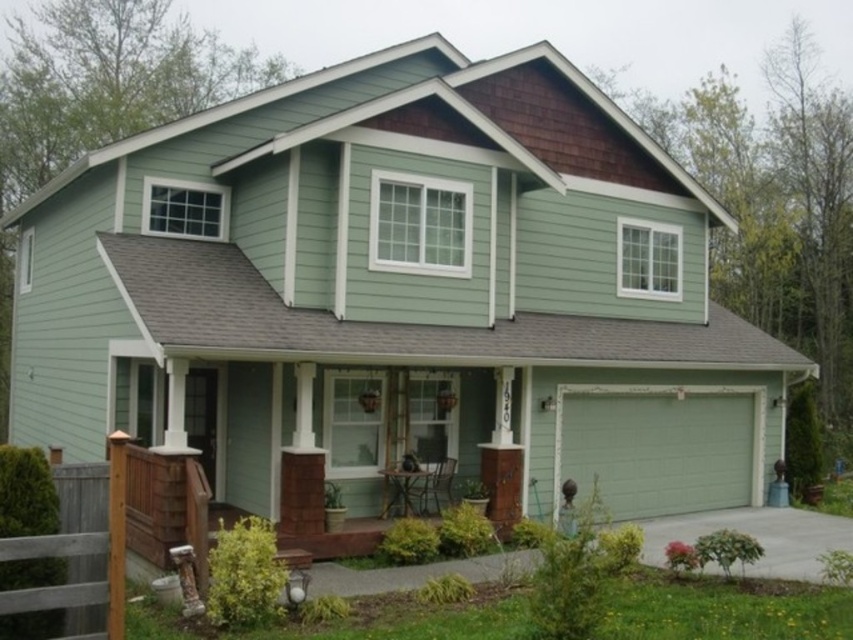
Is green smooth garage door at lower right wider than brown wooden fence at lower left?

Indeed, green smooth garage door at lower right has a greater width compared to brown wooden fence at lower left.

Who is more forward, (735, 408) or (71, 566)?

Point (71, 566) is in front.

Who is more distant from viewer, (569, 476) or (68, 561)?

Positioned behind is point (569, 476).

The height and width of the screenshot is (640, 853). I want to click on green smooth garage door at lower right, so click(660, 445).